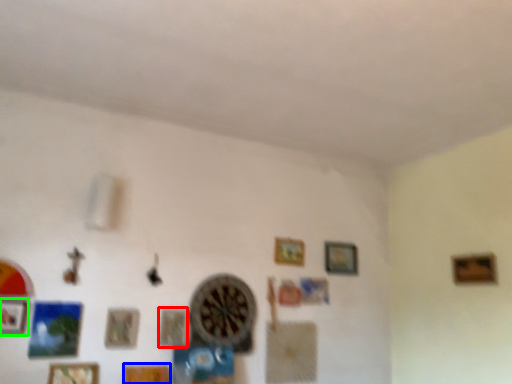
Question: Considering the real-world distances, which object is closest to picture frame (highlighted by a red box)? picture frame (highlighted by a blue box) or picture frame (highlighted by a green box).

Choices:
 (A) picture frame
 (B) picture frame

Answer: (A)